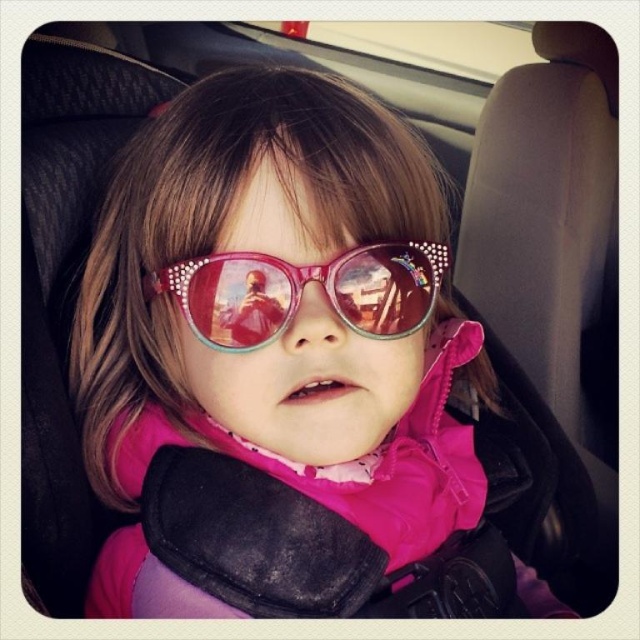
This screenshot has width=640, height=640. I want to click on pink glossy sunglasses at center, so click(x=282, y=307).

Locate an element on the screen. The height and width of the screenshot is (640, 640). pink glossy sunglasses at center is located at coordinates (282, 307).